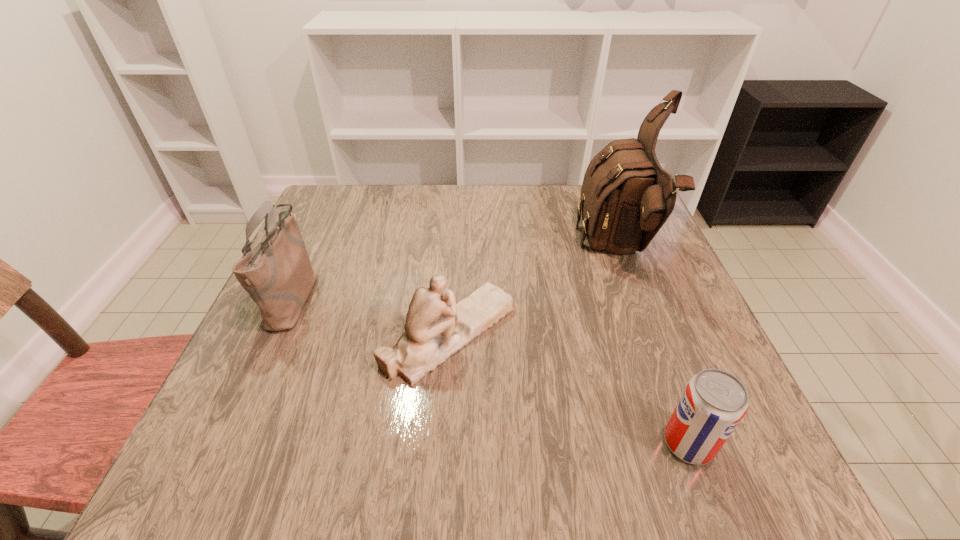
The image size is (960, 540). In order to click on the tallest object in this screenshot , I will do `click(626, 197)`.

Locate an element on the screen. This screenshot has height=540, width=960. the right shoulder bag is located at coordinates (626, 197).

Image resolution: width=960 pixels, height=540 pixels. I want to click on the leftmost object, so click(277, 274).

This screenshot has height=540, width=960. I want to click on the third shortest object, so click(x=277, y=274).

This screenshot has width=960, height=540. Identify the location of the third object from right to left. (436, 328).

Identify the location of the nearest object. The height and width of the screenshot is (540, 960). (714, 401).

This screenshot has height=540, width=960. Identify the location of vacant point located on the front-facing side of the right shoulder bag. (494, 250).

The height and width of the screenshot is (540, 960). In order to click on vacant area located 0.220m on the front-facing side of the right shoulder bag in this screenshot , I will do `click(491, 250)`.

I want to click on blank area located 0.070m on the front-facing side of the right shoulder bag, so click(551, 250).

In order to click on vacant region located on the front-facing side of the left shoulder bag in this screenshot , I will do pyautogui.click(x=362, y=297).